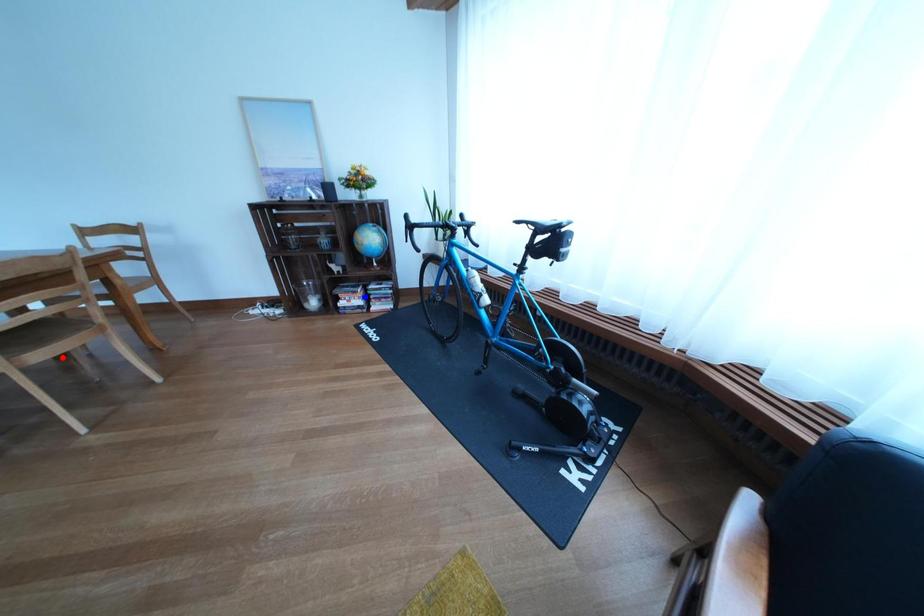
Question: Two points are marked on the image. Which point is closer to the camera?

Choices:
 (A) Blue point is closer.
 (B) Red point is closer.

Answer: (B)